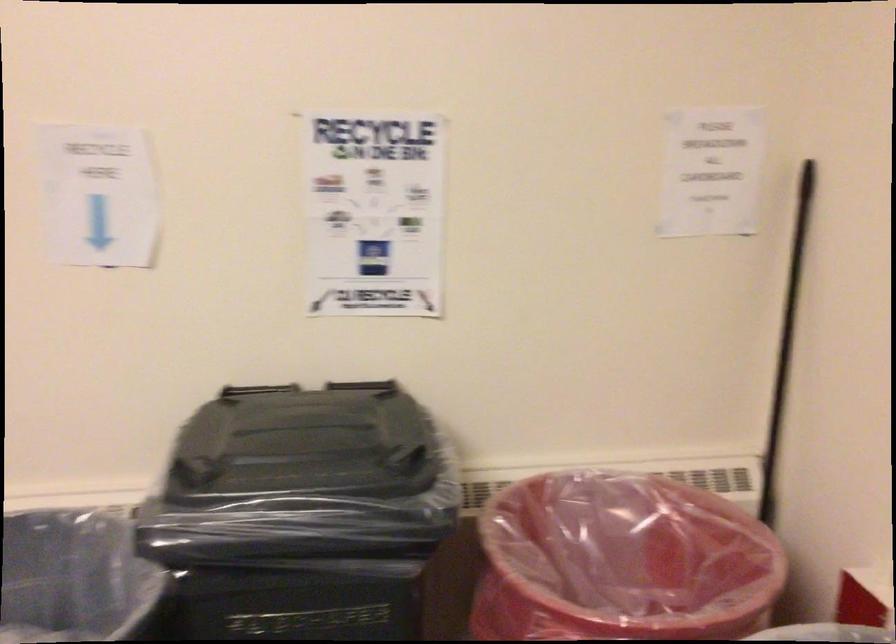
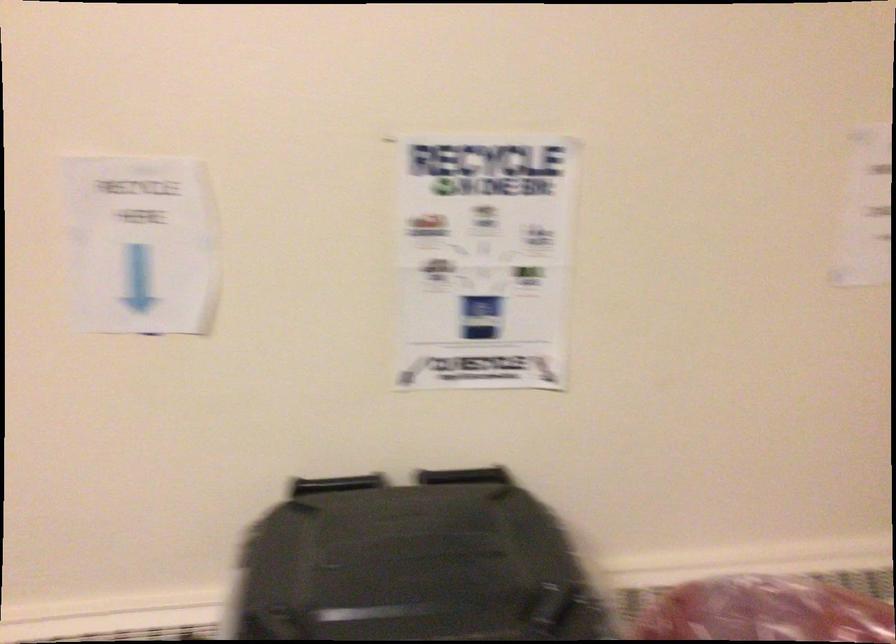
Question: The first image is from the beginning of the video and the second image is from the end. How did the camera likely rotate when shooting the video?

Choices:
 (A) Left
 (B) Right
 (C) Up
 (D) Down

Answer: (C)